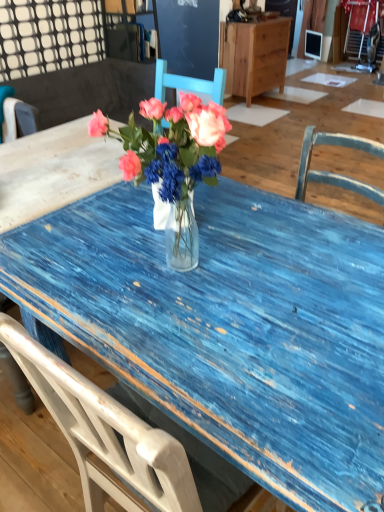
Question: Is matte glass vase at center to the left of white wood chair at left, which is the 2th chair from right to left, from the viewer's perspective?

Choices:
 (A) yes
 (B) no

Answer: (B)

Question: Can you confirm if matte glass vase at center is wider than white wood chair at left, which is the 2th chair from right to left?

Choices:
 (A) yes
 (B) no

Answer: (A)

Question: Does matte glass vase at center have a lesser height compared to white wood chair at left, which is the 2th chair from right to left?

Choices:
 (A) yes
 (B) no

Answer: (A)

Question: Is the depth of matte glass vase at center less than that of white wood chair at left, which is the 2th chair from right to left?

Choices:
 (A) yes
 (B) no

Answer: (A)

Question: Considering the relative sizes of matte glass vase at center and white wood chair at left, placed as the 1th chair when sorted from left to right, in the image provided, is matte glass vase at center thinner than white wood chair at left, placed as the 1th chair when sorted from left to right,?

Choices:
 (A) yes
 (B) no

Answer: (B)

Question: Is matte glass vase at center positioned beyond the bounds of white wood chair at left, which is the 2th chair from right to left?

Choices:
 (A) no
 (B) yes

Answer: (B)

Question: Is blue wooden chair at upper left, acting as the first chair starting from the right, to the right of matte glass vase at center from the viewer's perspective?

Choices:
 (A) no
 (B) yes

Answer: (A)

Question: Considering the relative sizes of blue wooden chair at upper left, which is the second chair in left-to-right order, and matte glass vase at center in the image provided, is blue wooden chair at upper left, which is the second chair in left-to-right order, smaller than matte glass vase at center?

Choices:
 (A) no
 (B) yes

Answer: (A)

Question: Are blue wooden chair at upper left, acting as the first chair starting from the right, and matte glass vase at center far apart?

Choices:
 (A) yes
 (B) no

Answer: (A)

Question: Would you say blue wooden chair at upper left, which is the second chair in left-to-right order, is outside matte glass vase at center?

Choices:
 (A) no
 (B) yes

Answer: (B)

Question: Is matte glass vase at center inside blue wooden chair at upper left, which is the second chair in left-to-right order?

Choices:
 (A) yes
 (B) no

Answer: (B)

Question: Is blue wooden chair at upper left, which is the second chair in left-to-right order, shorter than matte glass vase at center?

Choices:
 (A) no
 (B) yes

Answer: (A)

Question: Does blue wooden chair at upper left, which is the second chair in left-to-right order, appear on the left side of wooden cabinet at upper center?

Choices:
 (A) yes
 (B) no

Answer: (A)